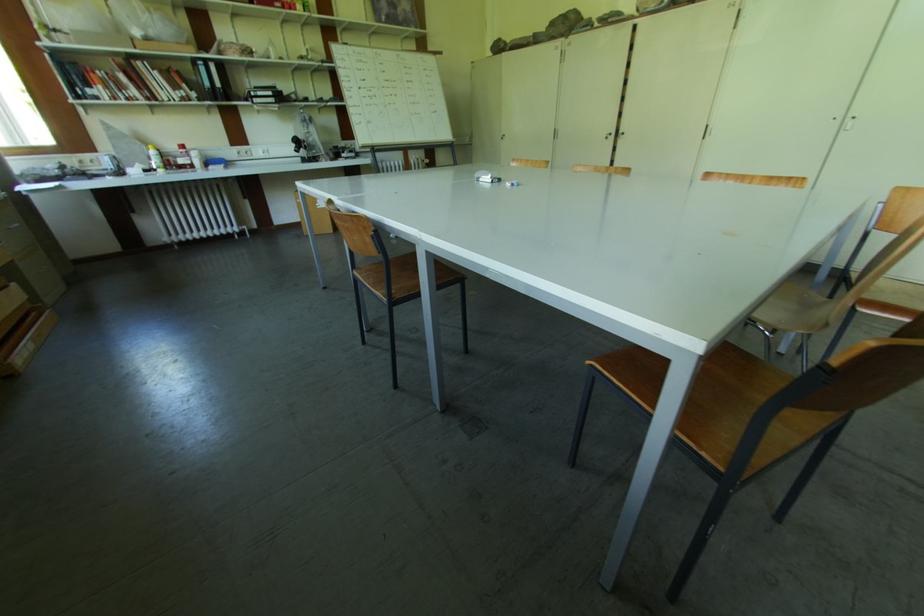
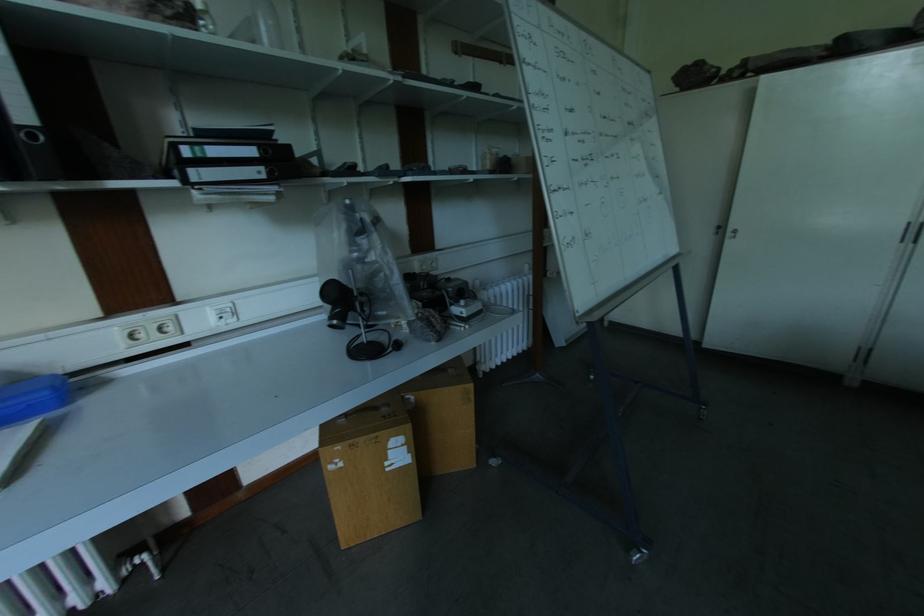
Find the pixel in the second image that matches the point at 505,140 in the first image.

(737, 238)